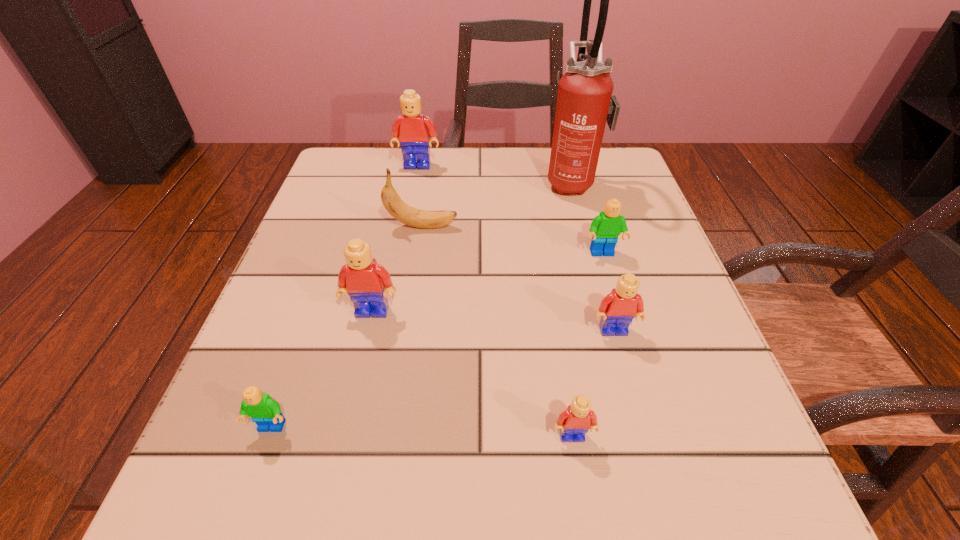
Where is `fire extinguisher`? fire extinguisher is located at coordinates (585, 103).

Locate an element on the screen. The image size is (960, 540). the tallest Lego is located at coordinates (412, 129).

Find the location of a particular element. The height and width of the screenshot is (540, 960). the biggest yellow Lego is located at coordinates (412, 129).

This screenshot has width=960, height=540. I want to click on the third farthest Lego, so click(x=367, y=282).

Find the location of a particular element. The image size is (960, 540). the second tallest Lego is located at coordinates (367, 282).

Identify the location of banana. The width and height of the screenshot is (960, 540). (396, 207).

The image size is (960, 540). I want to click on yellow banana, so click(x=396, y=207).

Find the location of a particular element. This screenshot has height=540, width=960. the third farthest yellow Lego is located at coordinates (618, 309).

Find the location of a particular element. The height and width of the screenshot is (540, 960). the rightmost yellow Lego is located at coordinates (618, 309).

The width and height of the screenshot is (960, 540). Find the location of `the right green Lego`. the right green Lego is located at coordinates tap(605, 228).